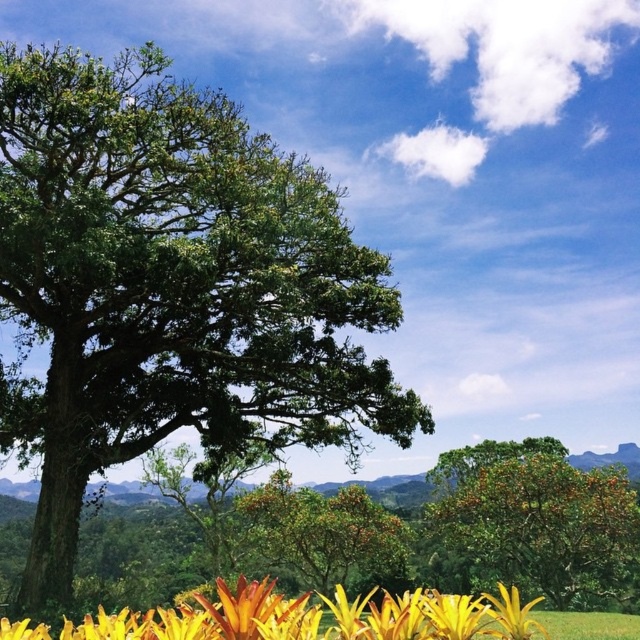
Can you confirm if green leafy oak tree at left is positioned below orange matte tree at center?

No, green leafy oak tree at left is not below orange matte tree at center.

Who is positioned more to the left, green leafy oak tree at left or orange matte tree at center?

green leafy oak tree at left

What do you see at coordinates (170, 288) in the screenshot? I see `green leafy oak tree at left` at bounding box center [170, 288].

I want to click on green leafy oak tree at left, so click(x=170, y=288).

Is point (456, 467) more distant than point (422, 621)?

Yes, it is.

Which is behind, point (550, 550) or point (214, 612)?

The point (550, 550) is behind.

This screenshot has height=640, width=640. In order to click on orange matte tree at center in this screenshot , I will do `click(540, 522)`.

Between point (390, 422) and point (115, 628), which one is positioned behind?

Positioned behind is point (390, 422).

Can you confirm if green leafy oak tree at left is positioned below yellow matte flower at lower center?

Incorrect, green leafy oak tree at left is not positioned below yellow matte flower at lower center.

The height and width of the screenshot is (640, 640). What do you see at coordinates (170, 288) in the screenshot? I see `green leafy oak tree at left` at bounding box center [170, 288].

Where is `green leafy oak tree at left`? green leafy oak tree at left is located at coordinates (170, 288).